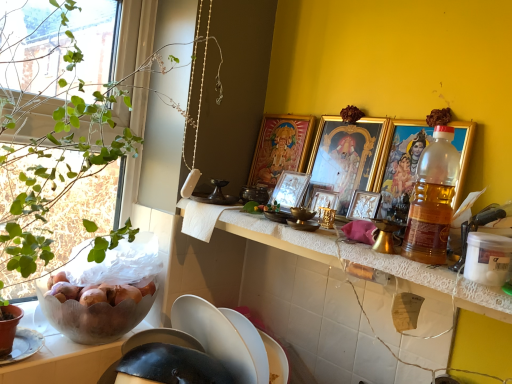
Question: Is gold metallic picture frame at upper center, the fourth picture frame positioned from the back, further to the viewer compared to metallic silver picture frame at center, the first picture frame in the back-to-front sequence?

Choices:
 (A) no
 (B) yes

Answer: (A)

Question: Considering the relative sizes of gold metallic picture frame at upper center, the 2th picture frame positioned from the front, and metallic silver picture frame at center, which appears as the 5th picture frame when viewed from the front, in the image provided, is gold metallic picture frame at upper center, the 2th picture frame positioned from the front, taller than metallic silver picture frame at center, which appears as the 5th picture frame when viewed from the front,?

Choices:
 (A) no
 (B) yes

Answer: (B)

Question: From the image's perspective, is gold metallic picture frame at upper center, the fourth picture frame positioned from the back, located above metallic silver picture frame at center, which appears as the 5th picture frame when viewed from the front?

Choices:
 (A) yes
 (B) no

Answer: (A)

Question: Is metallic silver picture frame at center, which appears as the 5th picture frame when viewed from the front, a part of gold metallic picture frame at upper center, the fourth picture frame positioned from the back?

Choices:
 (A) yes
 (B) no

Answer: (B)

Question: From a real-world perspective, is gold metallic picture frame at upper center, the 2th picture frame positioned from the front, located beneath metallic silver picture frame at center, which appears as the 5th picture frame when viewed from the front?

Choices:
 (A) no
 (B) yes

Answer: (A)

Question: Do you think gold-framed picture at right, arranged as the 5th picture frame when viewed from the back, is within translucent plastic bottle at right, or outside of it?

Choices:
 (A) inside
 (B) outside

Answer: (B)

Question: Based on their positions, is gold-framed picture at right, which is the 1th picture frame in front-to-back order, located to the left or right of translucent plastic bottle at right?

Choices:
 (A) left
 (B) right

Answer: (B)

Question: In terms of width, does gold-framed picture at right, arranged as the 5th picture frame when viewed from the back, look wider or thinner when compared to translucent plastic bottle at right?

Choices:
 (A) thin
 (B) wide

Answer: (A)

Question: In terms of height, does gold-framed picture at right, arranged as the 5th picture frame when viewed from the back, look taller or shorter compared to translucent plastic bottle at right?

Choices:
 (A) tall
 (B) short

Answer: (A)

Question: From the image's perspective, is metallic silver picture frame at center, the first picture frame in the back-to-front sequence, positioned above or below white lace countertop at center?

Choices:
 (A) below
 (B) above

Answer: (B)

Question: From a real-world perspective, relative to white lace countertop at center, is metallic silver picture frame at center, which appears as the 5th picture frame when viewed from the front, vertically above or below?

Choices:
 (A) above
 (B) below

Answer: (A)

Question: Is metallic silver picture frame at center, the first picture frame in the back-to-front sequence, wider or thinner than white lace countertop at center?

Choices:
 (A) thin
 (B) wide

Answer: (A)

Question: Is metallic silver picture frame at center, which appears as the 5th picture frame when viewed from the front, taller or shorter than white lace countertop at center?

Choices:
 (A) short
 (B) tall

Answer: (B)

Question: From a real-world perspective, relative to gold-framed picture at right, arranged as the 5th picture frame when viewed from the back, is green leafy plant at left vertically above or below?

Choices:
 (A) below
 (B) above

Answer: (A)

Question: Is green leafy plant at left spatially inside gold-framed picture at right, arranged as the 5th picture frame when viewed from the back, or outside of it?

Choices:
 (A) inside
 (B) outside

Answer: (B)